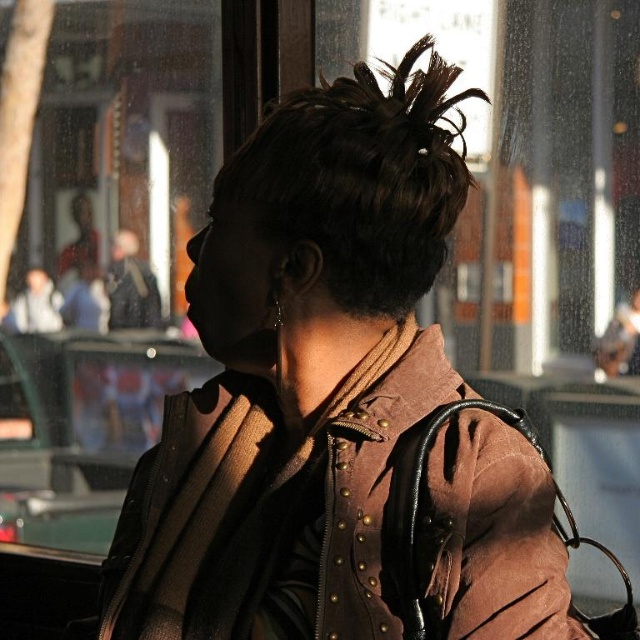
Is brown suede jacket at center taller than dark brown hair at upper center?

Yes, brown suede jacket at center is taller than dark brown hair at upper center.

Is point (285, 307) positioned after point (376, 211)?

Yes, point (285, 307) is farther from viewer.

Does point (371, 628) come farther from viewer compared to point (332, 97)?

No.

Locate an element on the screen. brown suede jacket at center is located at coordinates (298, 372).